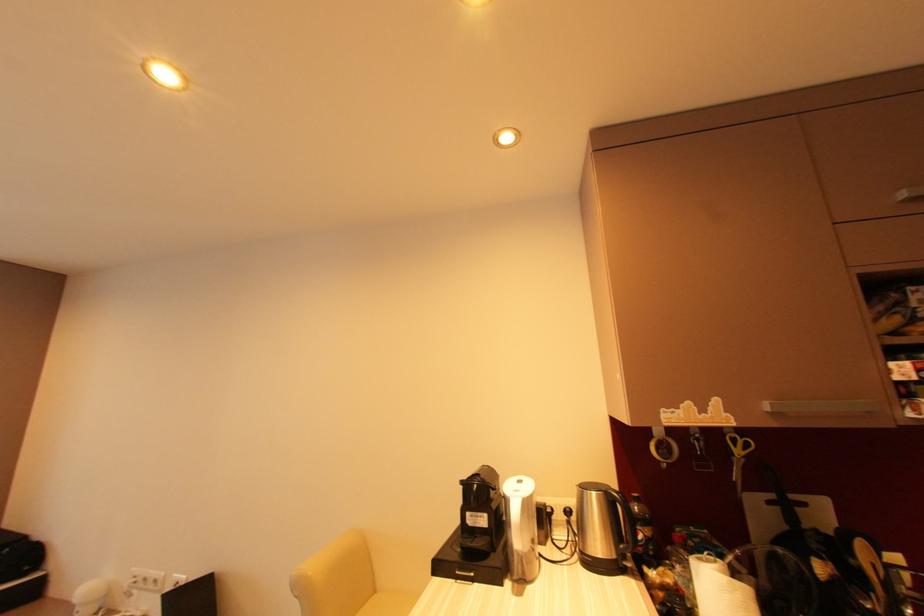
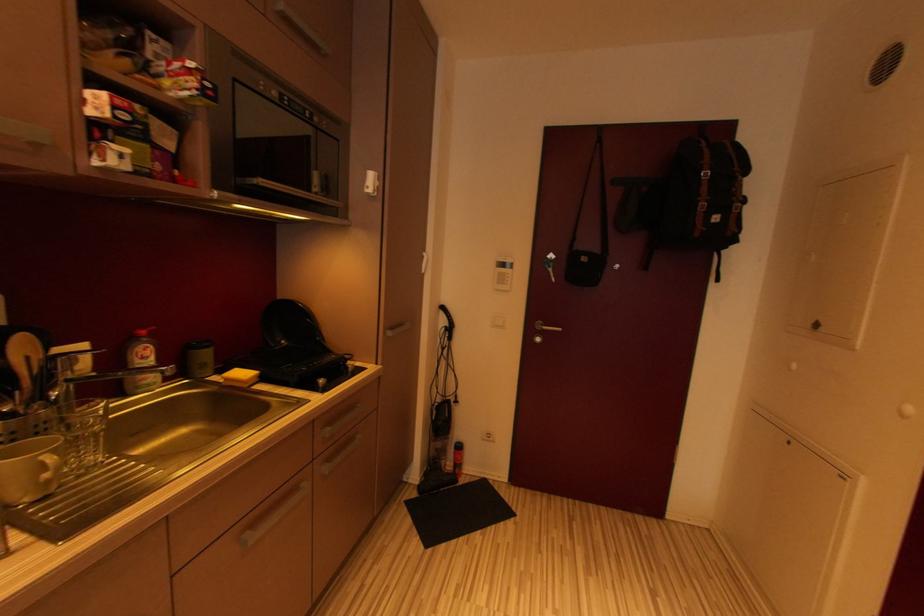
Question: The first image is from the beginning of the video and the second image is from the end. How did the camera likely rotate when shooting the video?

Choices:
 (A) Left
 (B) Right
 (C) Up
 (D) Down

Answer: (B)